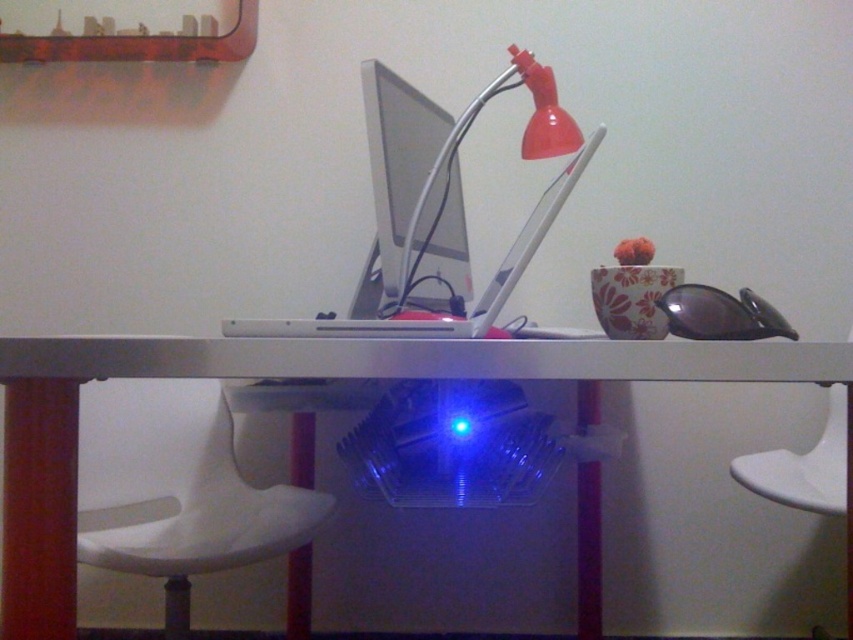
Consider the image. You are a person who is 1.7 meters tall. You want to sit on the white plastic chair at lower left while keeping your knees at least 0.5 meters away from the desk edge. Is this possible given the current setup?

The distance between the white plastic chair at lower left and the camera is 1.16 meters. Since the camera is positioned at eye level, which is typically around 1.6 meters height for a person of 1.7 meters tall, the vertical distance from the chair to the desk edge would need to be calculated. However, the provided information only specifies the horizontal distance between the chair and the camera, not the vertical clearance. Without knowing the desk height or the chair height, it is impossible to determine

You are standing at the desk and want to reach the satin silver monitor at center without moving your feet. Can you comfortably reach it if your arm can extend 1 meter?

The satin silver monitor at center is 1.15 meters away from camera, so if your arm can only extend 1 meter, you cannot comfortably reach it without moving your feet.

You are setting up a new monitor for a presentation. The existing satin silver monitor at center and the matte plastic lamp at upper center are on the desk. Which object has a smaller width?

The satin silver monitor at center has a smaller width than the matte plastic lamp at upper center.